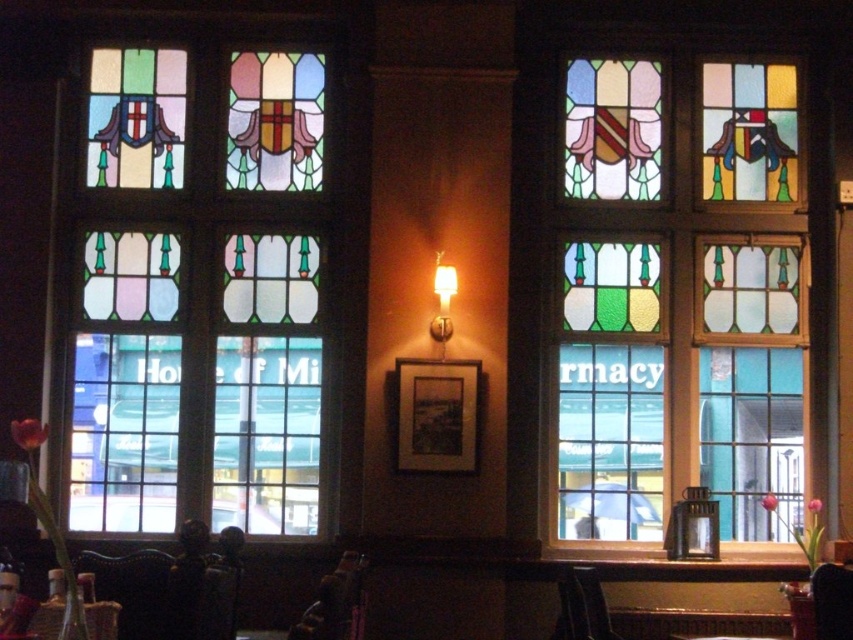
Who is lower down, stained glass window at left or stained glass window at center?

Positioned lower is stained glass window at center.

From the picture: Is stained glass window at left bigger than stained glass window at center?

No, stained glass window at left is not bigger than stained glass window at center.

Is point (144, 337) in front of point (735, 483)?

No, (144, 337) is behind (735, 483).

The height and width of the screenshot is (640, 853). In order to click on stained glass window at left in this screenshot , I will do `click(196, 292)`.

Who is positioned more to the left, stained glass window at center or stained glass window at upper right?

Positioned to the left is stained glass window at center.

Can you confirm if stained glass window at center is taller than stained glass window at upper right?

Correct, stained glass window at center is much taller as stained glass window at upper right.

Image resolution: width=853 pixels, height=640 pixels. Identify the location of stained glass window at center. (679, 296).

Can you confirm if matte stained glass shield at center is shorter than stained glass window at upper right?

Indeed, matte stained glass shield at center has a lesser height compared to stained glass window at upper right.

Can you confirm if matte stained glass shield at center is positioned to the left of stained glass window at upper right?

Yes, matte stained glass shield at center is to the left of stained glass window at upper right.

Is point (634, 118) more distant than point (715, 99)?

That is False.

Locate an element on the screen. The image size is (853, 640). matte stained glass shield at center is located at coordinates (612, 129).